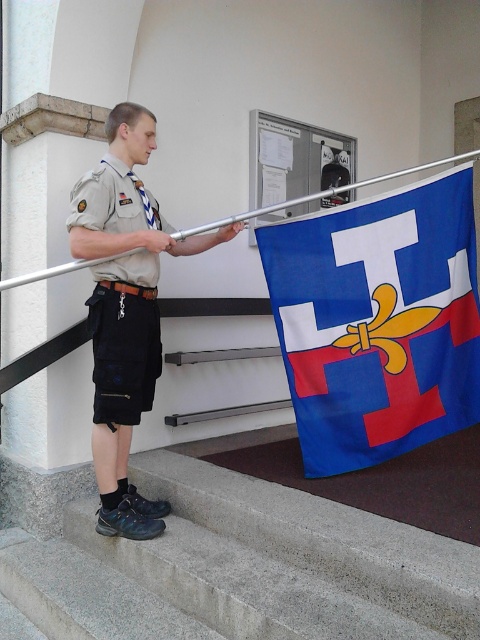
Measure the distance between point (97, 189) and camera.

Point (97, 189) and camera are 8.66 feet apart from each other.

Does point (115, 228) come closer to viewer compared to point (149, 321)?

Yes, it is in front of point (149, 321).

Find the location of a particular element. khaki uniform at center is located at coordinates (124, 308).

Which is behind, point (103, 552) or point (286, 336)?

Point (286, 336)

Who is more forward, (190, 512) or (381, 353)?

Positioned in front is point (190, 512).

This screenshot has width=480, height=640. Identify the location of concrete stairs at lower left. (242, 566).

Is point (140, 614) positioned in front of point (115, 260)?

That is True.

Between point (427, 582) and point (117, 470), which one is positioned behind?

Positioned behind is point (117, 470).

At what (x,y) coordinates should I click in order to perform the action: click on concrete stairs at lower left. Please return your answer as a coordinate pair (x, y). The height and width of the screenshot is (640, 480). Looking at the image, I should click on (242, 566).